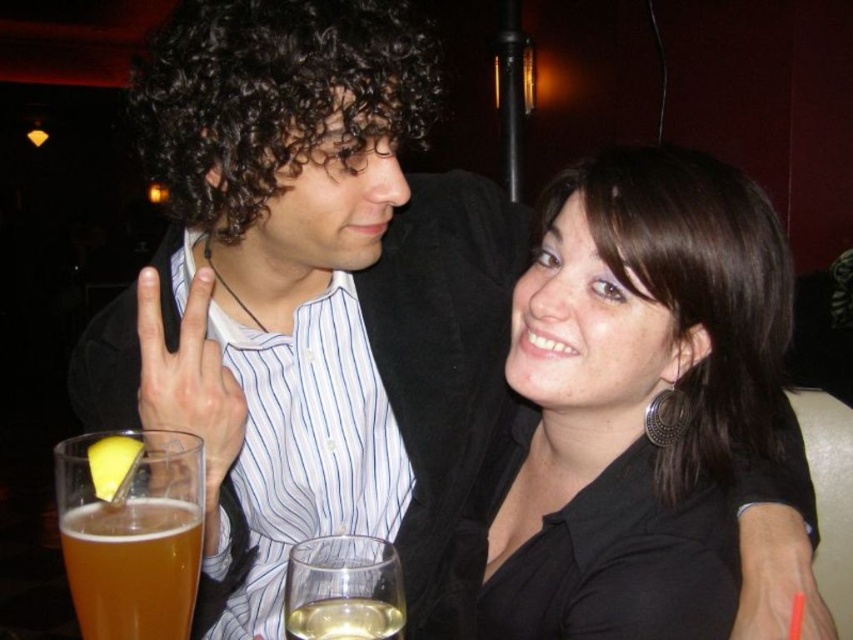
Find the location of `black matte shirt at center`. black matte shirt at center is located at coordinates (641, 420).

Does point (613, 324) come closer to viewer compared to point (193, 353)?

No, (613, 324) is further to viewer.

Where is `black matte shirt at center`? The height and width of the screenshot is (640, 853). black matte shirt at center is located at coordinates (641, 420).

This screenshot has height=640, width=853. Describe the element at coordinates (641, 420) in the screenshot. I see `black matte shirt at center` at that location.

Measure the distance from black matte shirt at center to translucent glass wine at lower center.

A distance of 15.02 inches exists between black matte shirt at center and translucent glass wine at lower center.

Is point (554, 264) positioned after point (375, 634)?

Yes, it is.

At what (x,y) coordinates should I click in order to perform the action: click on black matte shirt at center. Please return your answer as a coordinate pair (x, y). Image resolution: width=853 pixels, height=640 pixels. Looking at the image, I should click on (641, 420).

Based on the photo, can you confirm if translucent glass at lower left is taller than translucent glass wine at lower center?

Yes, translucent glass at lower left is taller than translucent glass wine at lower center.

Does translucent glass at lower left have a lesser width compared to translucent glass wine at lower center?

Incorrect, translucent glass at lower left's width is not less than translucent glass wine at lower center's.

Who is more distant from viewer, (114,609) or (380,628)?

The point (380,628) is more distant.

The width and height of the screenshot is (853, 640). I want to click on translucent glass at lower left, so click(131, 531).